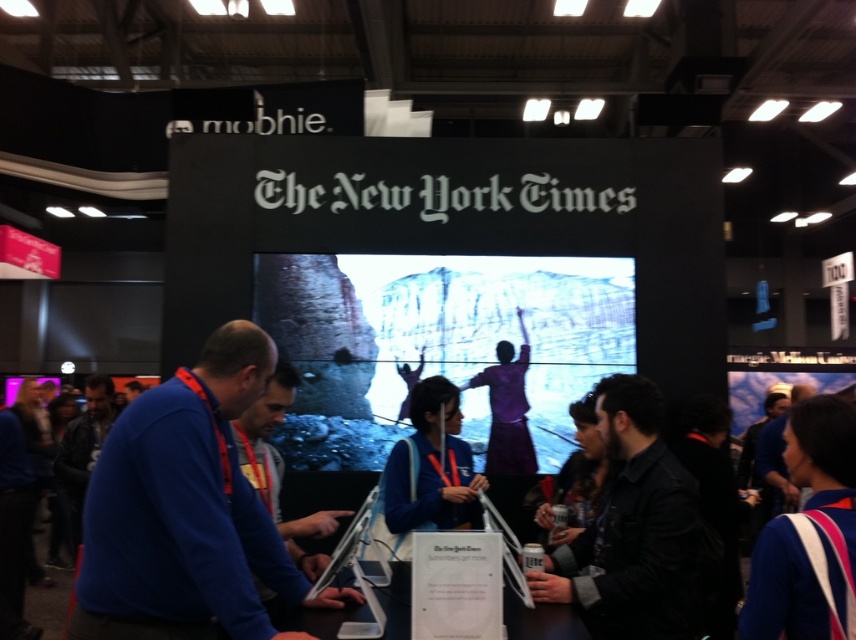
Please provide the 2D coordinates of the dark gray shirt at center in the image.

The dark gray shirt at center is located at point (633,531).

Looking at this image, you are standing at the entrance of the event space and want to locate the blue matte sweater at center. According to the coordinates given, in which direction should you walk to find it?

The blue matte sweater at center is located at coordinates point (186,512). Since the x coordinate is 0.800, which is closer to the right side, and the y coordinate is 0.218, closer to the bottom, you should walk towards the lower right direction to find it.

You are a photographer at the event and need to decide where to place a spotlight. The spotlight can only illuminate objects of a certain size. The leather jacket at left and the blue sweater at center are both in your frame. Which object requires a larger spotlight to fully illuminate?

The leather jacket at left requires a larger spotlight because it is larger in size than the blue sweater at center.